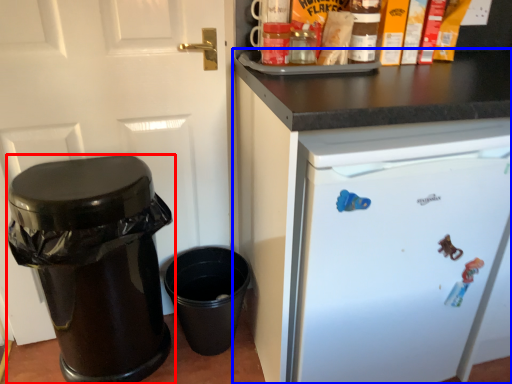
Question: Which object appears farthest to the camera in this image, waste container (highlighted by a red box) or cabinetry (highlighted by a blue box)?

Choices:
 (A) waste container
 (B) cabinetry

Answer: (A)